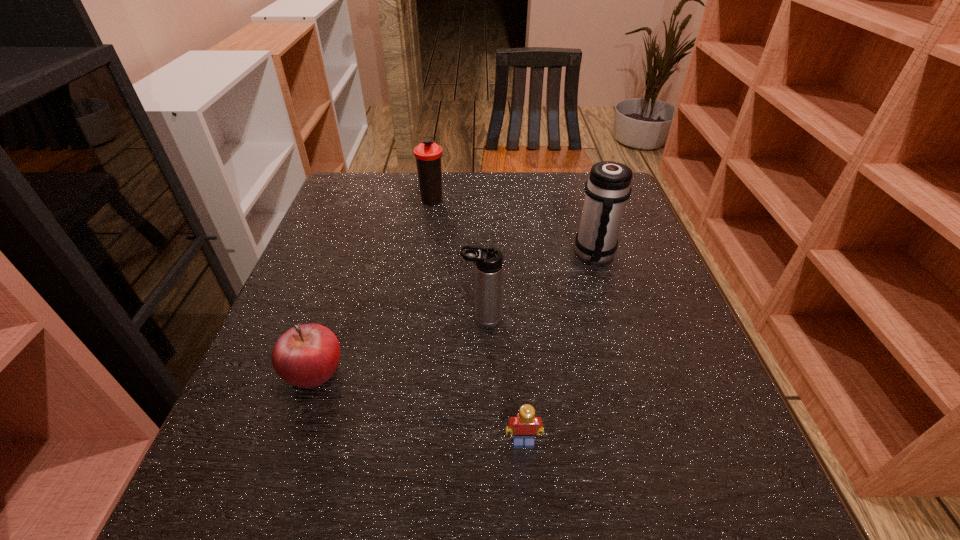
I want to click on free space at the left edge of the desktop, so click(x=302, y=424).

This screenshot has height=540, width=960. What are the coordinates of `vacant space at the right edge of the desktop` in the screenshot? It's located at (663, 401).

Locate an element on the screen. The width and height of the screenshot is (960, 540). free space at the far left corner of the desktop is located at coordinates (328, 203).

Locate an element on the screen. vacant space at the near left corner of the desktop is located at coordinates (245, 529).

Locate an element on the screen. This screenshot has height=540, width=960. vacant space at the far right corner is located at coordinates (632, 209).

Where is `vacant space at the near right corner of the desktop`? Image resolution: width=960 pixels, height=540 pixels. vacant space at the near right corner of the desktop is located at coordinates (749, 487).

Find the location of a particular element. unoccupied area between the second thermos bottle from right to left and the leftmost object is located at coordinates (397, 345).

Image resolution: width=960 pixels, height=540 pixels. Find the location of `free spot between the nearest object and the third farthest object`. free spot between the nearest object and the third farthest object is located at coordinates (503, 381).

At what (x,y) coordinates should I click in order to perform the action: click on free point between the apple and the farthest thermos bottle. Please return your answer as a coordinate pair (x, y). The height and width of the screenshot is (540, 960). Looking at the image, I should click on (373, 285).

Where is `empty location between the tallest object and the apple`? The image size is (960, 540). empty location between the tallest object and the apple is located at coordinates (454, 313).